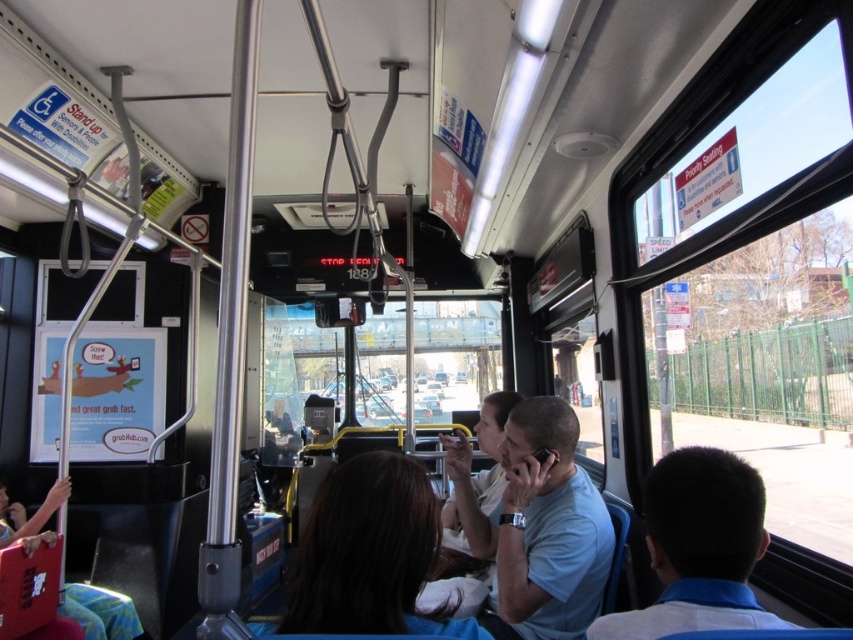
Does brown hair at center have a larger size compared to light blue t-shirt at center?

No.

Where is `brown hair at center`? The height and width of the screenshot is (640, 853). brown hair at center is located at coordinates (370, 554).

At what (x,y) coordinates should I click in order to perform the action: click on brown hair at center. Please return your answer as a coordinate pair (x, y). Looking at the image, I should click on (370, 554).

Does point (498, 512) lie in front of point (683, 467)?

That is False.

Consider the image. Between light blue t-shirt at center and dark blue shirt at right, which one appears on the right side from the viewer's perspective?

dark blue shirt at right

The image size is (853, 640). I want to click on light blue t-shirt at center, so click(546, 529).

Image resolution: width=853 pixels, height=640 pixels. Describe the element at coordinates (370, 554) in the screenshot. I see `brown hair at center` at that location.

Is brown hair at center smaller than dark blue shirt at right?

Correct, brown hair at center occupies less space than dark blue shirt at right.

Locate an element on the screen. This screenshot has height=640, width=853. brown hair at center is located at coordinates (370, 554).